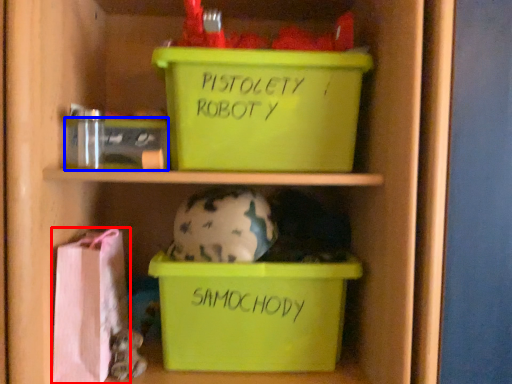
Question: Which of the following is the farthest to the observer, material (highlighted by a red box) or storage box (highlighted by a blue box)?

Choices:
 (A) material
 (B) storage box

Answer: (B)